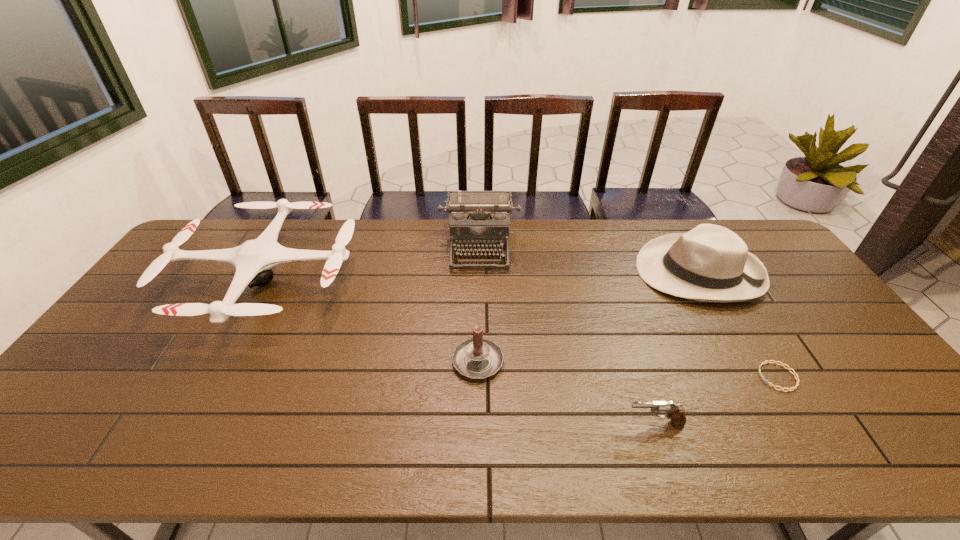
I want to click on vacant space located on the front-facing side of the fedora, so click(x=555, y=272).

Find the location of a particular element. This screenshot has height=540, width=960. vacant region located 0.310m with the camera attached at the bottom of the drone is located at coordinates (170, 460).

Locate an element on the screen. vacant region located on the side of the candle with the handle loop is located at coordinates (478, 293).

This screenshot has width=960, height=540. Find the location of `free spot located on the side of the candle with the handle loop`. free spot located on the side of the candle with the handle loop is located at coordinates (478, 298).

Locate an element on the screen. vacant space located 0.260m on the side of the candle with the handle loop is located at coordinates (478, 276).

Image resolution: width=960 pixels, height=540 pixels. I want to click on vacant space located at the barrel of the fourth object from left to right, so click(573, 423).

Image resolution: width=960 pixels, height=540 pixels. I want to click on free point located 0.290m at the barrel of the fourth object from left to right, so click(x=500, y=423).

Where is `free space located 0.320m at the barrel of the fourth object from left to right`? free space located 0.320m at the barrel of the fourth object from left to right is located at coordinates (488, 423).

What are the coordinates of `free point located on the surface of the bracelet showing star-shaped elements` in the screenshot? It's located at (650, 377).

Identify the location of vacant space located on the surface of the bracelet showing star-shaped elements. This screenshot has height=540, width=960. (661, 377).